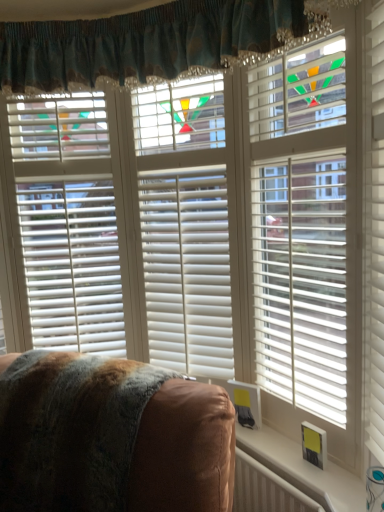
How much space does white matte blinds at right, which is counted as the 1th blind, starting from the right, occupy vertically?

The height of white matte blinds at right, which is counted as the 1th blind, starting from the right, is 1.68 meters.

What do you see at coordinates (111, 437) in the screenshot?
I see `brown leather chair at lower left` at bounding box center [111, 437].

What is the approximate width of brown leather chair at lower left?

32.73 inches.

What is the approximate height of white plastic radiator at lower right?

19.39 centimeters.

What is the approximate width of white matte blinds at center, the 2th blind positioned from the right?

It is 13.73 inches.

Identify the location of white matte blinds at right, which is counted as the 3th blind, starting from the left. The image size is (384, 512). (300, 230).

From a real-world perspective, relative to brown leather chair at lower left, is white wood blinds at left, marked as the 1th blind in a left-to-right arrangement, vertically above or below?

From a real-world perspective, white wood blinds at left, marked as the 1th blind in a left-to-right arrangement, is physically above brown leather chair at lower left.

Is white wood blinds at left, marked as the 1th blind in a left-to-right arrangement, surrounding brown leather chair at lower left?

No, brown leather chair at lower left is not surrounded by white wood blinds at left, marked as the 1th blind in a left-to-right arrangement.

Where is `blind on the left of brown leather chair at lower left`? Image resolution: width=384 pixels, height=512 pixels. blind on the left of brown leather chair at lower left is located at coordinates (67, 222).

Looking at their sizes, would you say white matte blinds at right, which is counted as the 1th blind, starting from the right, is wider or thinner than white plastic radiator at lower right?

Clearly, white matte blinds at right, which is counted as the 1th blind, starting from the right, has more width compared to white plastic radiator at lower right.

Could you measure the distance between white matte blinds at right, which is counted as the 3th blind, starting from the left, and white plastic radiator at lower right?

white matte blinds at right, which is counted as the 3th blind, starting from the left, is 22.22 inches from white plastic radiator at lower right.

Could you tell me if white matte blinds at right, which is counted as the 3th blind, starting from the left, is turned towards white plastic radiator at lower right?

No, white matte blinds at right, which is counted as the 3th blind, starting from the left, does not turn towards white plastic radiator at lower right.

Considering the positions of objects white matte blinds at right, which is counted as the 3th blind, starting from the left, and white plastic radiator at lower right in the image provided, who is more to the right, white matte blinds at right, which is counted as the 3th blind, starting from the left, or white plastic radiator at lower right?

Positioned to the right is white matte blinds at right, which is counted as the 3th blind, starting from the left.

Considering the positions of points (184, 325) and (41, 26), is point (184, 325) farther from camera compared to point (41, 26)?

That is True.

Does white matte blinds at center, positioned as the 2th blind in left-to-right order, contain teal fabric curtain at upper center?

No, teal fabric curtain at upper center is not surrounded by white matte blinds at center, positioned as the 2th blind in left-to-right order.

In terms of width, does white matte blinds at center, the 2th blind positioned from the right, look wider or thinner when compared to teal fabric curtain at upper center?

Clearly, white matte blinds at center, the 2th blind positioned from the right, has less width compared to teal fabric curtain at upper center.

Would you consider white matte blinds at center, the 2th blind positioned from the right, to be distant from teal fabric curtain at upper center?

No, white matte blinds at center, the 2th blind positioned from the right, is not far from teal fabric curtain at upper center.

Based on their sizes in the image, would you say teal fabric curtain at upper center is bigger or smaller than white wood blinds at left, marked as the 1th blind in a left-to-right arrangement?

In the image, teal fabric curtain at upper center appears to be larger than white wood blinds at left, marked as the 1th blind in a left-to-right arrangement.

At what (x,y) coordinates should I click in order to perform the action: click on curtain that is above the white wood blinds at left, marked as the 1th blind in a left-to-right arrangement (from the image's perspective). Please return your answer as a coordinate pair (x, y). Image resolution: width=384 pixels, height=512 pixels. Looking at the image, I should click on (151, 42).

Between point (115, 46) and point (84, 323), which one is positioned in front?

The point (115, 46) is closer.

Between white matte blinds at center, positioned as the 2th blind in left-to-right order, and white wood blinds at left, placed as the 3th blind when sorted from right to left, which one has smaller width?

With smaller width is white wood blinds at left, placed as the 3th blind when sorted from right to left.

From a real-world perspective, is white matte blinds at center, the 2th blind positioned from the right, positioned under white wood blinds at left, marked as the 1th blind in a left-to-right arrangement, based on gravity?

Correct, in the physical world, white matte blinds at center, the 2th blind positioned from the right, is lower than white wood blinds at left, marked as the 1th blind in a left-to-right arrangement.

How distant is white matte blinds at center, positioned as the 2th blind in left-to-right order, from white wood blinds at left, marked as the 1th blind in a left-to-right arrangement?

They are 14.89 inches apart.

Which object is closer to the camera taking this photo, white matte blinds at center, positioned as the 2th blind in left-to-right order, or white wood blinds at left, placed as the 3th blind when sorted from right to left?

white matte blinds at center, positioned as the 2th blind in left-to-right order, is closer to the camera.

How different are the orientations of teal fabric curtain at upper center and white plastic radiator at lower right in degrees?

They differ by 28.7 degrees in their facing directions.

Considering the positions of points (247, 37) and (281, 494), is point (247, 37) closer to camera compared to point (281, 494)?

Yes, point (247, 37) is in front of point (281, 494).

From a real-world perspective, is teal fabric curtain at upper center physically located above or below white plastic radiator at lower right?

Clearly, from a real-world perspective, teal fabric curtain at upper center is above white plastic radiator at lower right.

Is teal fabric curtain at upper center at the right side of white plastic radiator at lower right?

No, teal fabric curtain at upper center is not to the right of white plastic radiator at lower right.

In the scene shown: Can you confirm if white wood blinds at left, marked as the 1th blind in a left-to-right arrangement, is bigger than white plastic radiator at lower right?

Correct, white wood blinds at left, marked as the 1th blind in a left-to-right arrangement, is larger in size than white plastic radiator at lower right.

From a real-world perspective, who is located lower, white wood blinds at left, placed as the 3th blind when sorted from right to left, or white plastic radiator at lower right?

From a 3D spatial view, white plastic radiator at lower right is below.

How distant is white wood blinds at left, placed as the 3th blind when sorted from right to left, from white plastic radiator at lower right?

A distance of 1.16 meters exists between white wood blinds at left, placed as the 3th blind when sorted from right to left, and white plastic radiator at lower right.

From the image's perspective, between white wood blinds at left, placed as the 3th blind when sorted from right to left, and white plastic radiator at lower right, who is located below?

white plastic radiator at lower right, from the image's perspective.

The image size is (384, 512). I want to click on the 3rd blind behind the brown leather chair at lower left, so click(67, 222).

Identify the location of window sill on the left of white matte blinds at right, which is counted as the 1th blind, starting from the right. Image resolution: width=384 pixels, height=512 pixels. (303, 470).

Estimate the real-world distances between objects in this image. Which object is closer to white matte blinds at center, positioned as the 2th blind in left-to-right order, white plastic radiator at lower right or white plastic radiator at lower right?

white plastic radiator at lower right lies closer to white matte blinds at center, positioned as the 2th blind in left-to-right order, than the other object.

When comparing their distances from white matte blinds at center, the 2th blind positioned from the right, does white plastic radiator at lower right or brown leather chair at lower left seem further?

Based on the image, brown leather chair at lower left appears to be further to white matte blinds at center, the 2th blind positioned from the right.

Considering their positions, is white wood blinds at left, placed as the 3th blind when sorted from right to left, positioned closer to teal fabric curtain at upper center than white plastic radiator at lower right?

white wood blinds at left, placed as the 3th blind when sorted from right to left.

From the image, which object appears to be nearer to white matte blinds at right, which is counted as the 3th blind, starting from the left, white matte blinds at center, the 2th blind positioned from the right, or brown leather chair at lower left?

white matte blinds at center, the 2th blind positioned from the right.

From the image, which object appears to be nearer to white wood blinds at left, marked as the 1th blind in a left-to-right arrangement, teal fabric curtain at upper center or white plastic radiator at lower right?

The object closer to white wood blinds at left, marked as the 1th blind in a left-to-right arrangement, is teal fabric curtain at upper center.

From the image, which object appears to be farther from white wood blinds at left, marked as the 1th blind in a left-to-right arrangement, teal fabric curtain at upper center or white matte blinds at center, the 2th blind positioned from the right?

teal fabric curtain at upper center lies further to white wood blinds at left, marked as the 1th blind in a left-to-right arrangement, than the other object.

Based on the photo, estimate the real-world distances between objects in this image. Which object is closer to white plastic radiator at lower right, brown leather chair at lower left or teal fabric curtain at upper center?

The object closer to white plastic radiator at lower right is brown leather chair at lower left.

From the image, which object appears to be nearer to white matte blinds at center, the 2th blind positioned from the right, brown leather chair at lower left or white matte blinds at right, which is counted as the 3th blind, starting from the left?

white matte blinds at right, which is counted as the 3th blind, starting from the left, lies closer to white matte blinds at center, the 2th blind positioned from the right, than the other object.

Locate an element on the screen. The width and height of the screenshot is (384, 512). blind between teal fabric curtain at upper center and white matte blinds at center, positioned as the 2th blind in left-to-right order, from front to back is located at coordinates (300, 230).

The height and width of the screenshot is (512, 384). Find the location of `window sill positioned between brown leather chair at lower left and white matte blinds at center, the 2th blind positioned from the right, from near to far`. window sill positioned between brown leather chair at lower left and white matte blinds at center, the 2th blind positioned from the right, from near to far is located at coordinates (303, 470).

Find the location of a particular element. This screenshot has height=512, width=384. furniture between white matte blinds at center, the 2th blind positioned from the right, and white plastic radiator at lower right, in the vertical direction is located at coordinates (111, 437).

The image size is (384, 512). What are the coordinates of `window sill that lies between white matte blinds at center, the 2th blind positioned from the right, and white plastic radiator at lower right from top to bottom` in the screenshot? It's located at (303, 470).